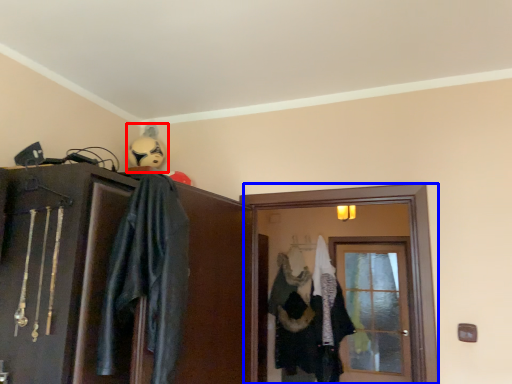
Question: Which object is further to the camera taking this photo, comic book character (highlighted by a red box) or screen door (highlighted by a blue box)?

Choices:
 (A) comic book character
 (B) screen door

Answer: (A)